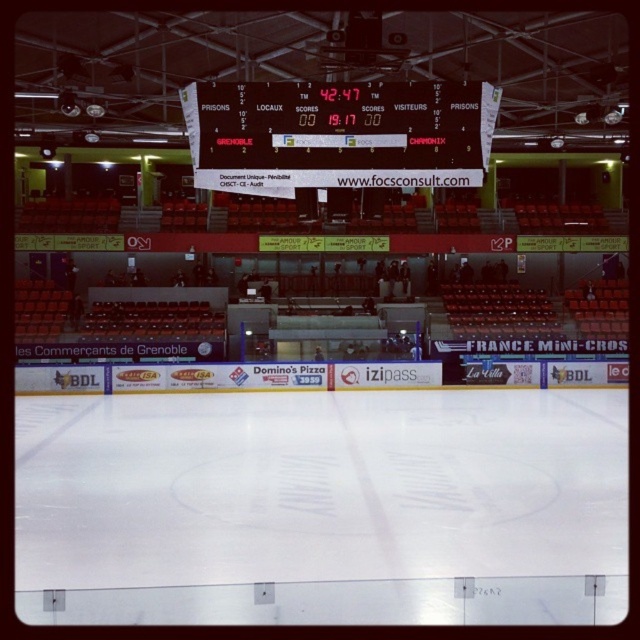
Does point (240, 611) lie in front of point (412, 106)?

Yes, point (240, 611) is in front of point (412, 106).

Who is more forward, (360, 468) or (288, 116)?

Positioned in front is point (288, 116).

Between point (426, 586) and point (289, 116), which one is positioned behind?

Point (289, 116)

Identify the location of white smooth ice at center. (323, 506).